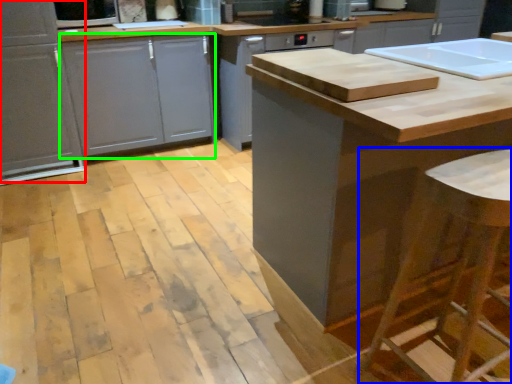
Question: Based on their relative distances, which object is farther from cabinetry (highlighted by a red box)? Choose from bar stool (highlighted by a blue box) and drawer (highlighted by a green box).

Choices:
 (A) bar stool
 (B) drawer

Answer: (A)